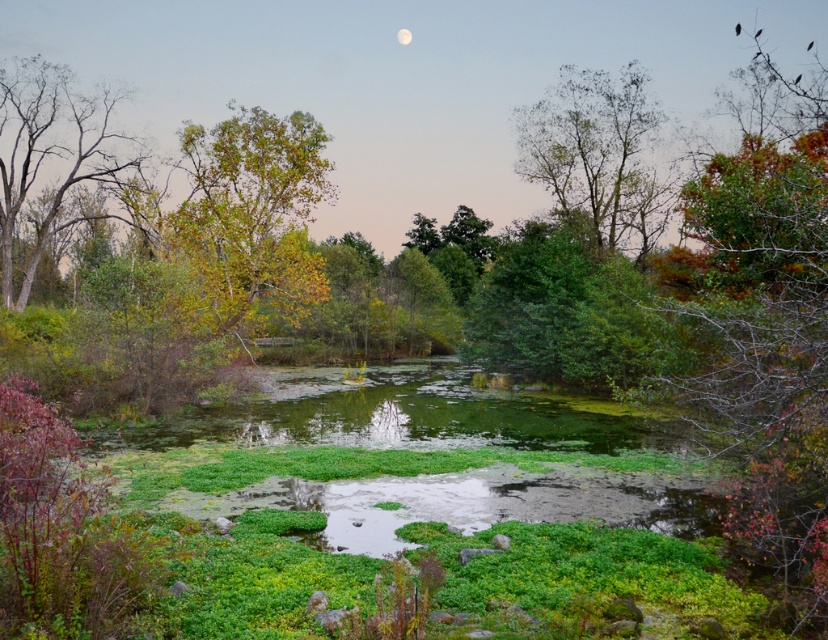
Does bare wood tree at left have a greater width compared to white glossy moon at upper center?

Indeed, bare wood tree at left has a greater width compared to white glossy moon at upper center.

Between bare wood tree at left and white glossy moon at upper center, which one is positioned higher?

white glossy moon at upper center is above.

This screenshot has height=640, width=828. Find the location of `bare wood tree at left`. bare wood tree at left is located at coordinates (49, 163).

Can you confirm if bare wood tree at left is thinner than green leafy tree at upper center?

No.

Does point (70, 152) come in front of point (627, 154)?

No, (70, 152) is further to viewer.

Which is in front, point (71, 92) or point (590, 198)?

Point (71, 92)

The height and width of the screenshot is (640, 828). What are the coordinates of `bare wood tree at left` in the screenshot? It's located at (49, 163).

Can you confirm if green leafy tree at center is positioned to the right of green leafy tree at upper center?

No, green leafy tree at center is not to the right of green leafy tree at upper center.

Between point (195, 216) and point (621, 195), which one is positioned in front?

Positioned in front is point (195, 216).

Is point (244, 170) farther from viewer compared to point (614, 173)?

That is False.

Where is `green leafy tree at center`? green leafy tree at center is located at coordinates (253, 214).